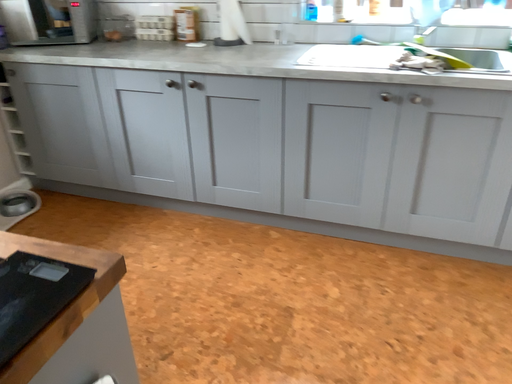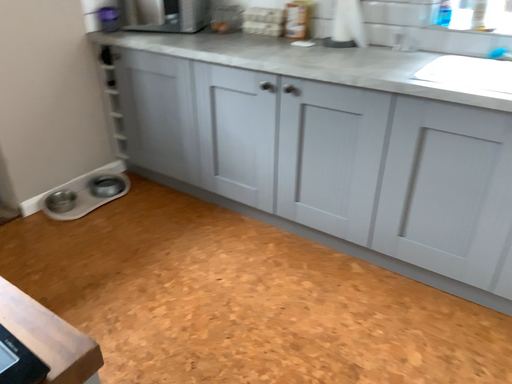
Question: Which way did the camera rotate in the video?

Choices:
 (A) rotated left
 (B) rotated right

Answer: (A)